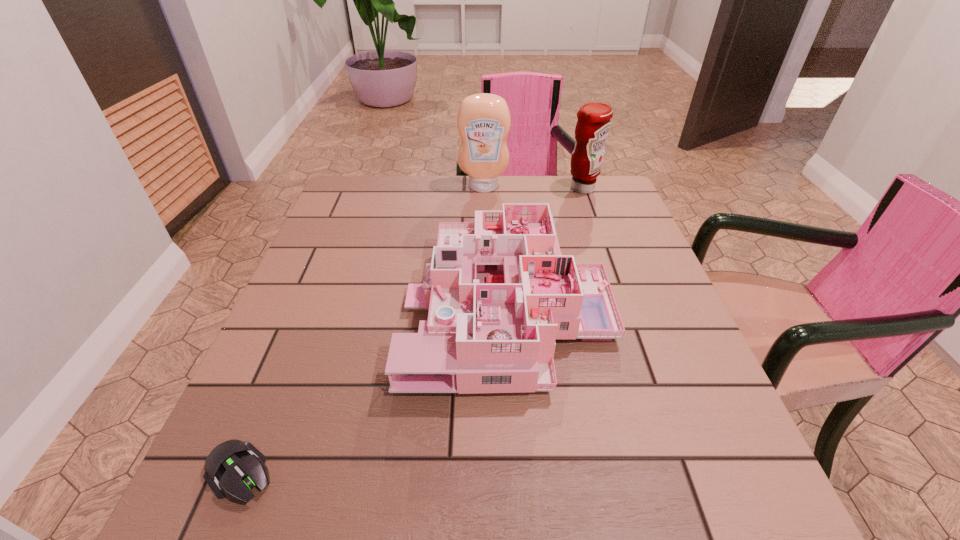
The image size is (960, 540). In order to click on the left condiment in this screenshot , I will do `click(483, 120)`.

In order to click on the right condiment in this screenshot , I will do `click(593, 125)`.

At what (x,y) coordinates should I click in order to perform the action: click on dollhouse. Please return your answer as a coordinate pair (x, y). The height and width of the screenshot is (540, 960). Looking at the image, I should click on (499, 291).

This screenshot has width=960, height=540. I want to click on the third farthest object, so click(x=499, y=291).

The image size is (960, 540). I want to click on the shortest object, so click(233, 467).

Where is `computer mouse`? The height and width of the screenshot is (540, 960). computer mouse is located at coordinates (233, 467).

This screenshot has width=960, height=540. Identify the location of free space located 0.390m on the label of the left condiment. (485, 282).

Image resolution: width=960 pixels, height=540 pixels. What are the coordinates of `vacant space located 0.240m on the left of the right condiment` in the screenshot? It's located at (486, 188).

Locate an element on the screen. This screenshot has height=540, width=960. vacant region located 0.080m at the front entrance of the second shortest object is located at coordinates (371, 306).

This screenshot has height=540, width=960. I want to click on blank space located 0.240m at the front entrance of the second shortest object, so click(x=296, y=306).